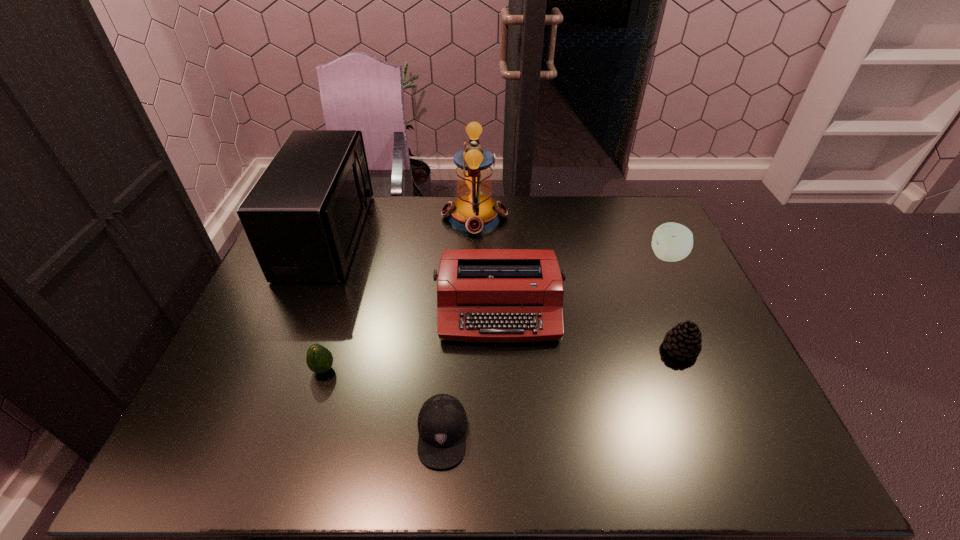
Locate an element on the screen. The image size is (960, 540). free point between the apple and the typewriter is located at coordinates (584, 282).

Locate an element on the screen. This screenshot has height=540, width=960. free space between the typewriter and the pinecone is located at coordinates (589, 329).

Locate an element on the screen. This screenshot has height=540, width=960. blank region between the lantern and the avocado is located at coordinates (399, 293).

Where is `free space between the shortest object and the apple`? The height and width of the screenshot is (540, 960). free space between the shortest object and the apple is located at coordinates click(555, 345).

Select which object appears as the sixth closest to the microwave_oven. Please provide its 2D coordinates. Your answer should be formatted as a tuple, i.e. [(x, y)], where the tuple contains the x and y coordinates of a point satisfying the conditions above.

[(671, 242)]

The width and height of the screenshot is (960, 540). Find the location of `object that stands as the fourth closest to the typewriter`. object that stands as the fourth closest to the typewriter is located at coordinates (684, 340).

Locate an element on the screen. The image size is (960, 540). free space that satisfies the following two spatial constraints: 1. at the narrow end of the pinecone; 2. on the front-facing side of the cap is located at coordinates (714, 433).

Identify the location of vacant region that satisfies the following two spatial constraints: 1. on the front-facing side of the sixth shortest object; 2. on the right side of the avocado. This screenshot has width=960, height=540. (274, 369).

What are the coordinates of `vacant area in the image that satisfies the following two spatial constraints: 1. at the narrow end of the pinecone; 2. on the front-facing side of the shortest object` in the screenshot? It's located at (714, 433).

The height and width of the screenshot is (540, 960). What are the coordinates of `vacant position in the image that satisfies the following two spatial constraints: 1. on the back side of the apple; 2. on the front-facing side of the lantern` in the screenshot? It's located at (648, 217).